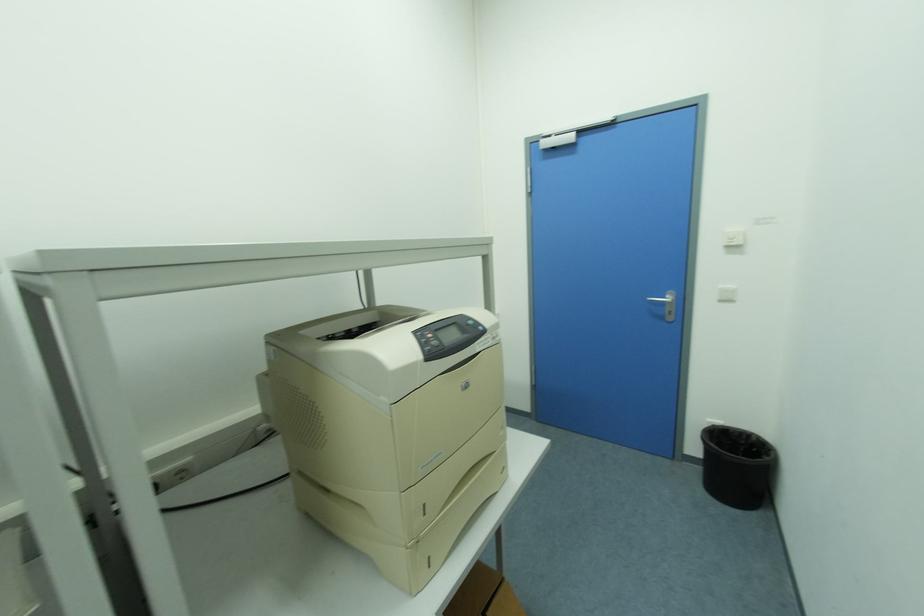
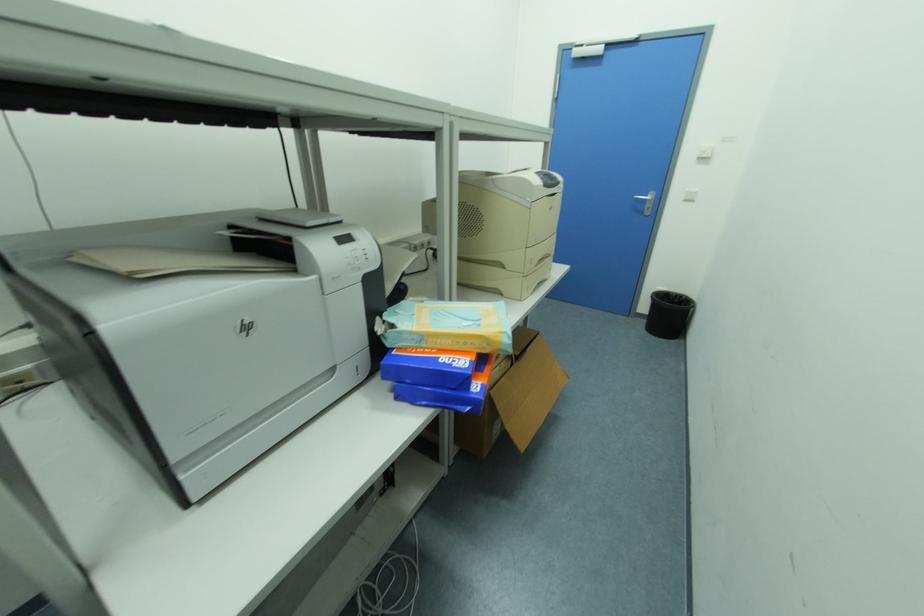
Question: Based on the continuous images, in which direction is the camera rotating? Reply with the corresponding letter.

Choices:
 (A) Left
 (B) Right
 (C) Up
 (D) Down

Answer: (D)